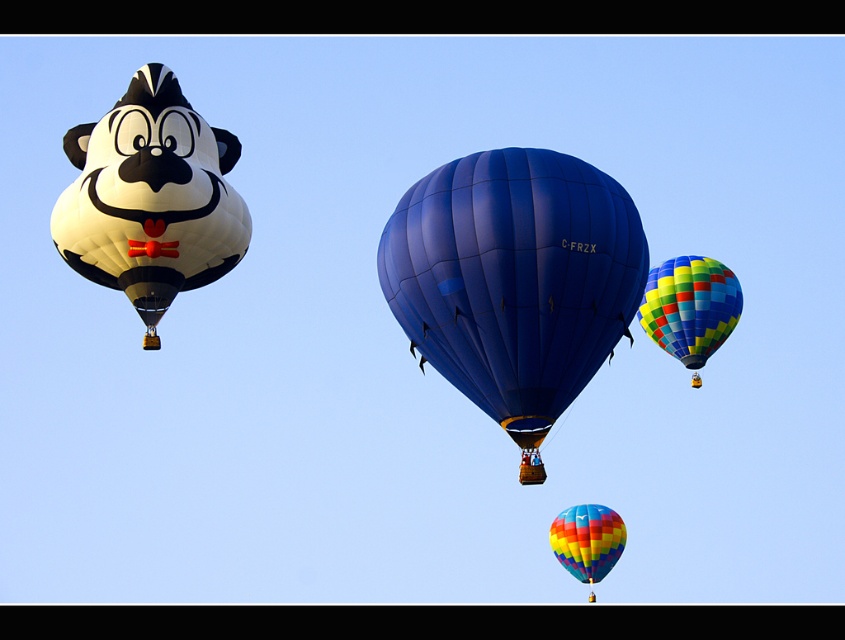
You are a pilot preparing to land your hot air balloon. You see the blue glossy hot air balloon at center and the white matte balloon at left in the sky. Which one should you avoid colliding with first?

The blue glossy hot air balloon at center is closer to the viewer than the white matte balloon at left, so you should avoid colliding with the blue glossy hot air balloon at center first.

You are a hot air balloon pilot planning to land your balloon in a small field. You see the blue glossy hot air balloon at center and the white matte balloon at left in the sky. Which balloon will require a larger landing area due to its size?

The blue glossy hot air balloon at center requires a larger landing area because it is larger in size than the white matte balloon at left.

Please determine the 2D coordinates of the white matte balloon at left in the scene. The scene has a cat shaped balloon and a dark blue balloon with the identifier C FRZX on its side.

The 2D coordinates of the white matte balloon at left are at point (151, 198).